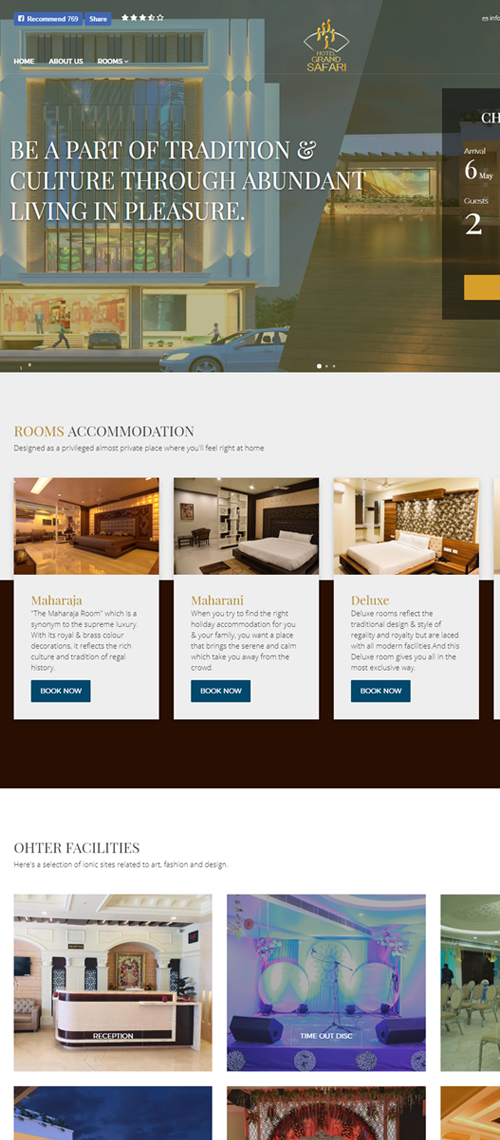
Image resolution: width=500 pixels, height=1140 pixels. I want to click on plant, so click(x=184, y=985).